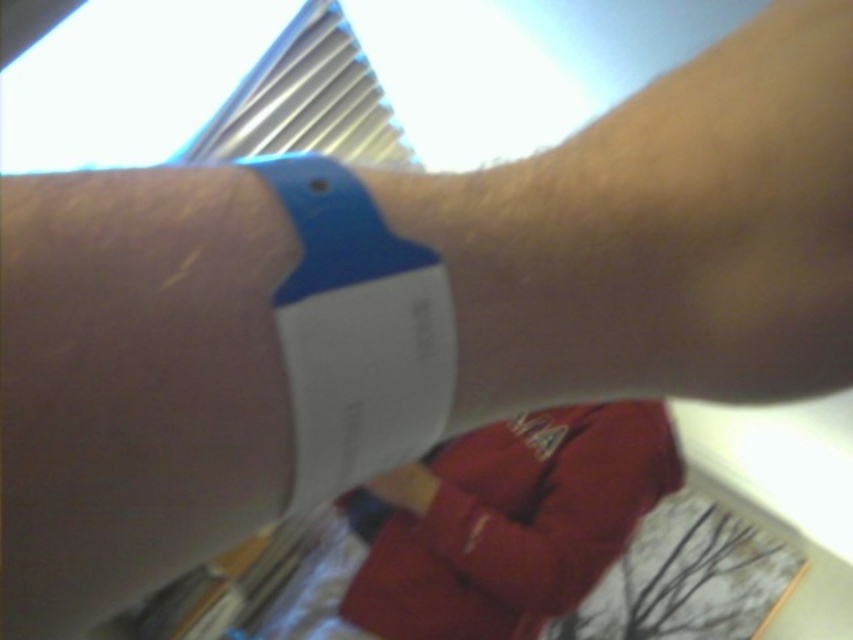
Can you confirm if matte red jacket at center is taller than matte plastic wristband at center?

Correct, matte red jacket at center is much taller as matte plastic wristband at center.

Describe the element at coordinates (515, 524) in the screenshot. I see `matte red jacket at center` at that location.

You are a GUI agent. You are given a task and a screenshot of the screen. Output one action in this format:
    pyautogui.click(x=<x>, y=<y>)
    Task: Click on the matte red jacket at center
    Image resolution: width=853 pixels, height=640 pixels.
    Given the screenshot: What is the action you would take?
    pyautogui.click(x=515, y=524)

Is white plastic wristband at center below matte red jacket at center?

No.

Can you confirm if white plastic wristband at center is positioned above matte red jacket at center?

Yes.

The image size is (853, 640). I want to click on white plastic wristband at center, so click(196, 369).

Which is more to the left, matte red jacket at center or blue rubber wristband at center?

From the viewer's perspective, blue rubber wristband at center appears more on the left side.

Is matte red jacket at center to the left of blue rubber wristband at center from the viewer's perspective?

No, matte red jacket at center is not to the left of blue rubber wristband at center.

Is point (495, 508) positioned after point (398, 408)?

That is True.

Identify the location of matte red jacket at center. This screenshot has height=640, width=853. (515, 524).